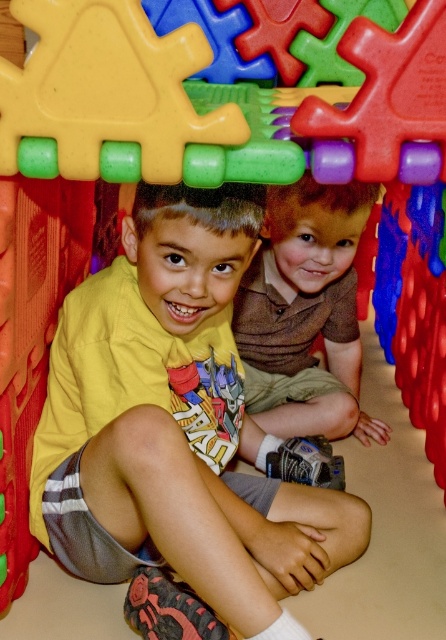
Question: Can you confirm if yellow cotton shirt at center is positioned to the right of brown textured shirt at center?

Choices:
 (A) no
 (B) yes

Answer: (A)

Question: Which object is farther from the camera taking this photo?

Choices:
 (A) yellow cotton shirt at center
 (B) brown textured shirt at center

Answer: (B)

Question: Which of the following is the closest to the observer?

Choices:
 (A) brown textured shirt at center
 (B) yellow cotton shirt at center

Answer: (B)

Question: Is yellow cotton shirt at center further to camera compared to brown textured shirt at center?

Choices:
 (A) yes
 (B) no

Answer: (B)

Question: Is yellow cotton shirt at center positioned before brown textured shirt at center?

Choices:
 (A) yes
 (B) no

Answer: (A)